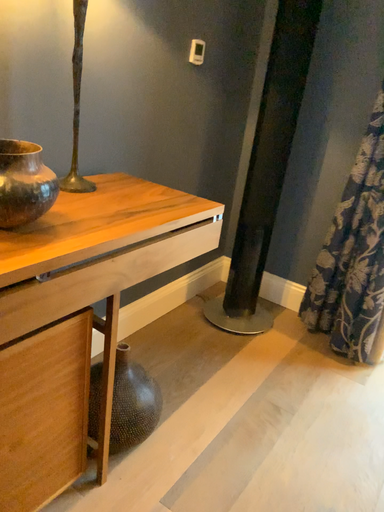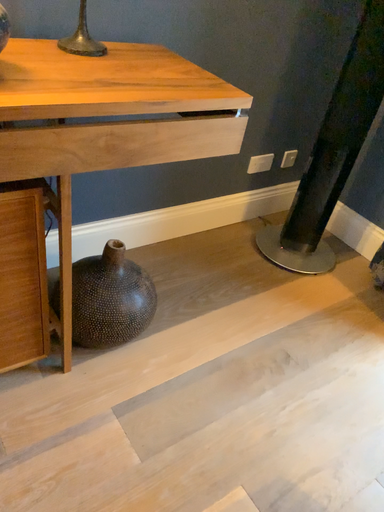
Question: Which way did the camera rotate in the video?

Choices:
 (A) rotated right
 (B) rotated left

Answer: (B)